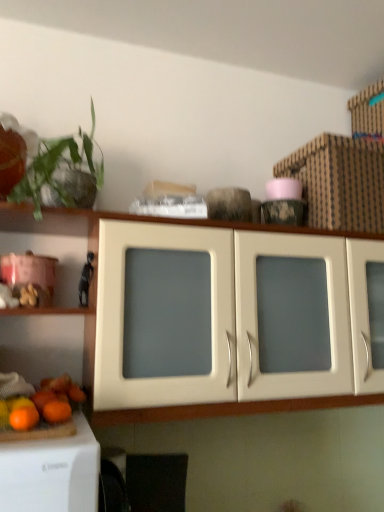
Question: Looking at the image, does matte white cabinet at center seem bigger or smaller compared to orange matte at lower left, the 2th orange positioned from the back?

Choices:
 (A) small
 (B) big

Answer: (B)

Question: Is point (170, 407) closer or farther from the camera than point (24, 430)?

Choices:
 (A) farther
 (B) closer

Answer: (A)

Question: Based on their relative distances, which object is farther from the orange matte at lower left, the 2th orange positioned from the back?

Choices:
 (A) matte white cabinet at center
 (B) green leafy plant at upper left
 (C) brown cardboard box at upper right
 (D) orange matte at lower left, which is the 2th orange from front to back
 (E) black matte figurine at left

Answer: (C)

Question: Which is farther from the brown cardboard box at upper right?

Choices:
 (A) black matte figurine at left
 (B) green leafy plant at upper left
 (C) orange matte at lower left, which is the 2th orange from front to back
 (D) orange matte at lower left, the 2th orange positioned from the back
 (E) matte white cabinet at center

Answer: (D)